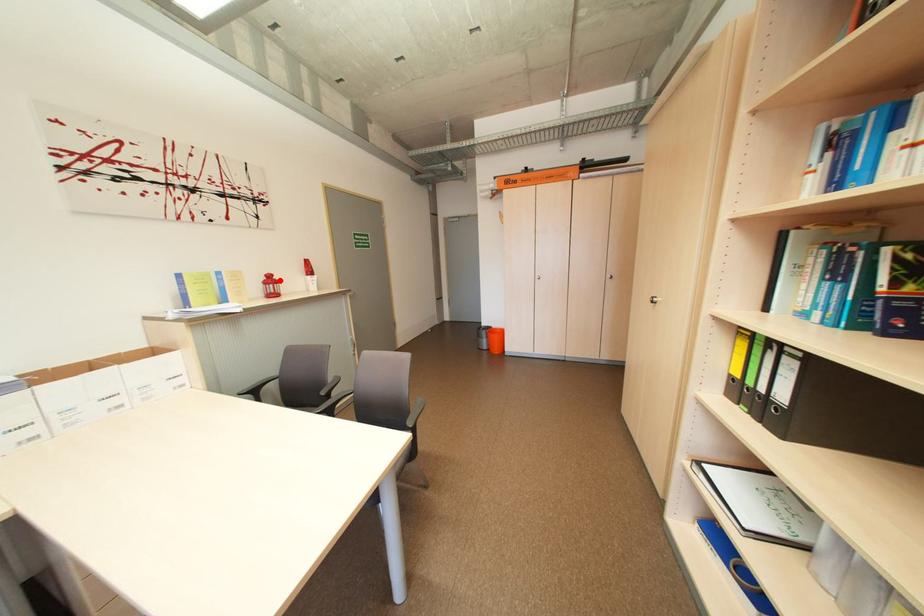
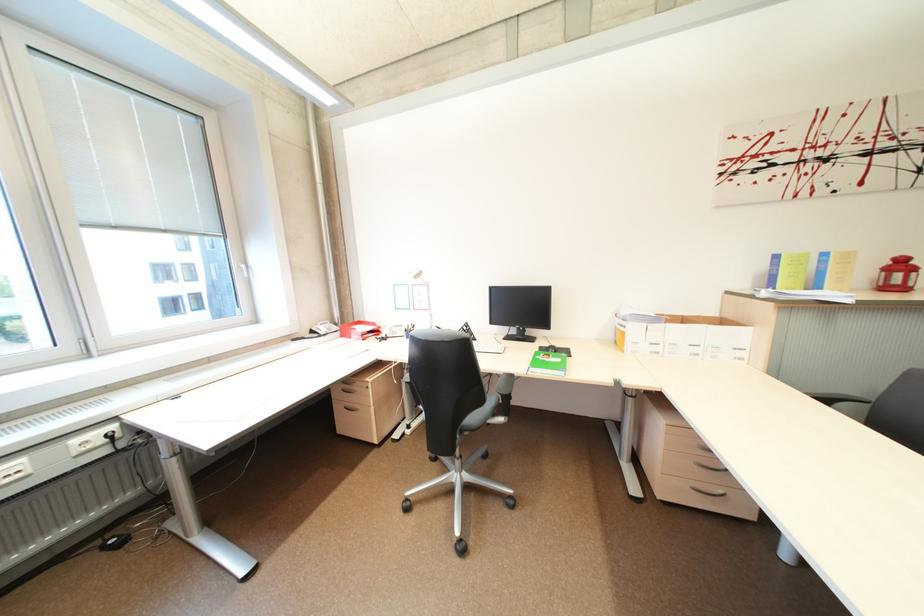
Question: I am providing you with two images of the same scene from different viewpoints. A red point is shown in image1. For the corresponding object point in image2, is it positioned nearer or farther from the camera?

Choices:
 (A) Nearer
 (B) Farther

Answer: (B)